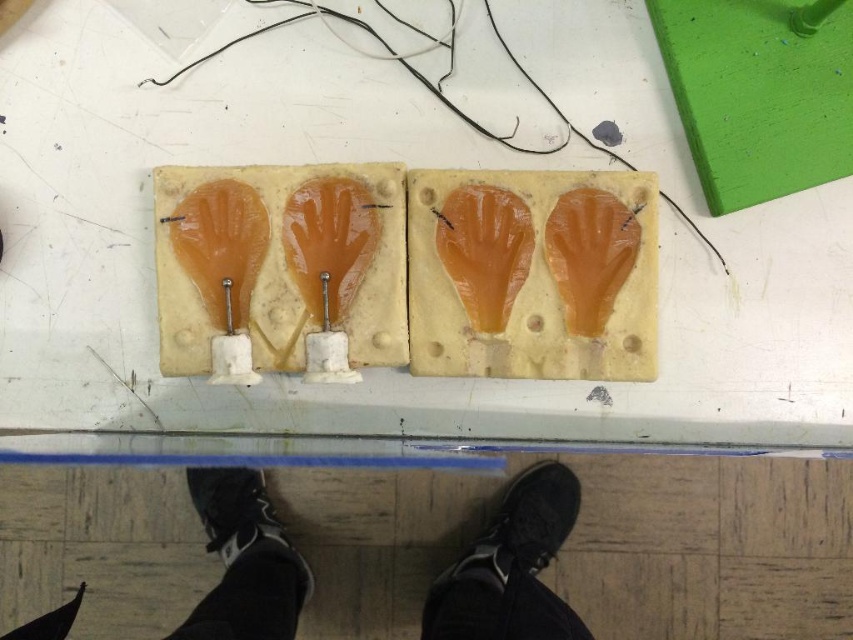
Looking at this image, you are standing in front of the workspace and see four blocks with handprints. There is a point marked at coordinates (511, 566). Which object from the list contains this point? The objects are the four blocks with handprints and the black synthetic shoe at lower center.

The point (511, 566) is located on the black synthetic shoe at lower center, so the object containing this point is the black synthetic shoe at lower center.

You are an inspector examining the workspace and notice two shoes, the black synthetic shoe at lower center and the black rubber shoe at lower center. Which shoe is positioned closer to you?

The black synthetic shoe at lower center is closer to the viewer than the black rubber shoe at lower center, so the black synthetic shoe at lower center is positioned closer to you.